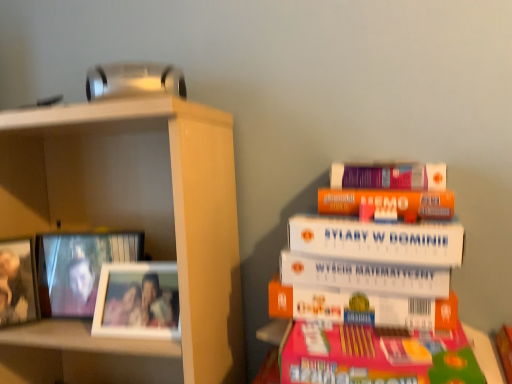
Question: Is white matte book at upper right a part of metallic silver picture frame at left, positioned as the 1th picture frame in left-to-right order?

Choices:
 (A) no
 (B) yes

Answer: (A)

Question: Considering the relative positions of metallic silver picture frame at left, positioned as the 1th picture frame in left-to-right order, and white matte book at upper right in the image provided, is metallic silver picture frame at left, positioned as the 1th picture frame in left-to-right order, to the left of white matte book at upper right from the viewer's perspective?

Choices:
 (A) yes
 (B) no

Answer: (A)

Question: Is metallic silver picture frame at left, acting as the 3th picture frame starting from the right, shorter than white matte book at upper right?

Choices:
 (A) no
 (B) yes

Answer: (B)

Question: Considering the relative sizes of metallic silver picture frame at left, acting as the 3th picture frame starting from the right, and white matte book at upper right in the image provided, is metallic silver picture frame at left, acting as the 3th picture frame starting from the right, bigger than white matte book at upper right?

Choices:
 (A) no
 (B) yes

Answer: (A)

Question: Is metallic silver picture frame at left, positioned as the 1th picture frame in left-to-right order, looking in the opposite direction of white matte book at upper right?

Choices:
 (A) no
 (B) yes

Answer: (A)

Question: Is metallic silver picture frame at left, acting as the 3th picture frame starting from the right, wider or thinner than white matte book at upper right?

Choices:
 (A) thin
 (B) wide

Answer: (A)

Question: Considering the positions of point (35, 306) and point (272, 233), is point (35, 306) closer or farther from the camera than point (272, 233)?

Choices:
 (A) closer
 (B) farther

Answer: (A)

Question: Which is correct: metallic silver picture frame at left, acting as the 3th picture frame starting from the right, is inside white matte book at upper right, or outside of it?

Choices:
 (A) outside
 (B) inside

Answer: (A)

Question: Based on their positions, is metallic silver picture frame at left, acting as the 3th picture frame starting from the right, located to the left or right of white matte book at upper right?

Choices:
 (A) right
 (B) left

Answer: (B)

Question: From a real-world perspective, relative to wooden photo frame at left, the second picture frame from the right, is white matte book at upper right vertically above or below?

Choices:
 (A) below
 (B) above

Answer: (B)

Question: From the image's perspective, relative to wooden photo frame at left, the second picture frame from the right, is white matte book at upper right above or below?

Choices:
 (A) above
 (B) below

Answer: (A)

Question: In the image, is white matte book at upper right positioned in front of or behind wooden photo frame at left, which is counted as the second picture frame, starting from the left?

Choices:
 (A) front
 (B) behind

Answer: (A)

Question: Is white matte book at upper right wider or thinner than wooden photo frame at left, which is counted as the second picture frame, starting from the left?

Choices:
 (A) wide
 (B) thin

Answer: (A)

Question: Does point tap(109, 294) appear closer or farther from the camera than point tap(18, 317)?

Choices:
 (A) closer
 (B) farther

Answer: (A)

Question: Is white matte picture frame at left, positioned as the first picture frame in right-to-left order, bigger or smaller than metallic silver picture frame at left, positioned as the 1th picture frame in left-to-right order?

Choices:
 (A) big
 (B) small

Answer: (A)